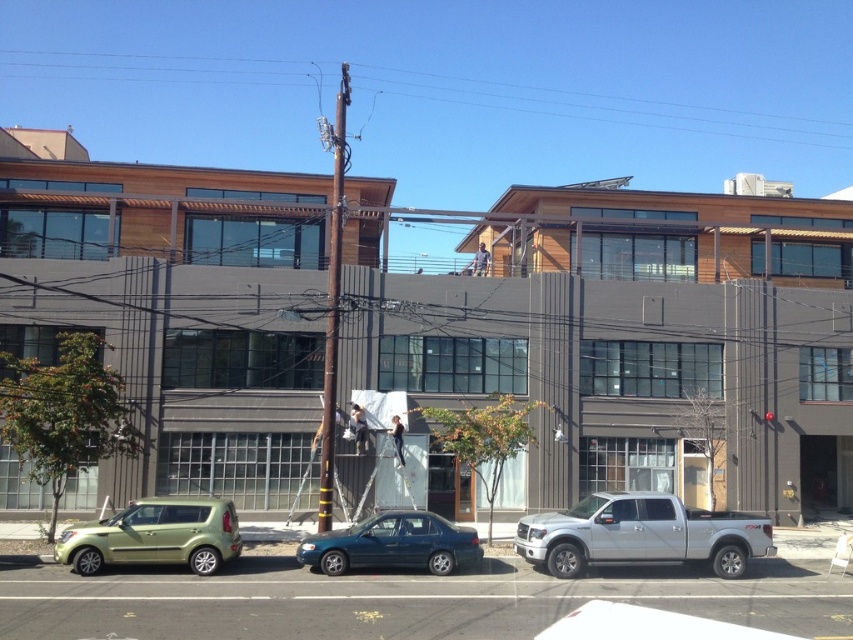
You are a delivery driver needing to park your vehicle near the teal glossy sedan at center without blocking the metallic pole at upper center. Given that your vehicle is 5 meters long, can you safely park your vehicle between them?

The metallic pole at upper center is 135.32 meters away from the teal glossy sedan at center. Since your vehicle is only 5 meters long, there is sufficient space between them to park without blocking the pole.

You are standing on the sidewalk in front of the building and see two points marked on the ground. The first point is at coordinates point (616, 520) and the second point is at point (219, 515). Which point is closer to you?

Point (616, 520) is further to the viewer than point (219, 515), so the second point is closer to you.

You are a delivery driver needing to unload a 7.5 meter long trailer between the silver metallic truck at lower right and the metallic green hatchback at lower left. Based on the scene, can you fit the trailer in the space between them?

The space between the silver metallic truck at lower right and the metallic green hatchback at lower left is only 6.67 meters, which is shorter than the 7.5 meter trailer. Therefore, the trailer cannot fit in the available space.